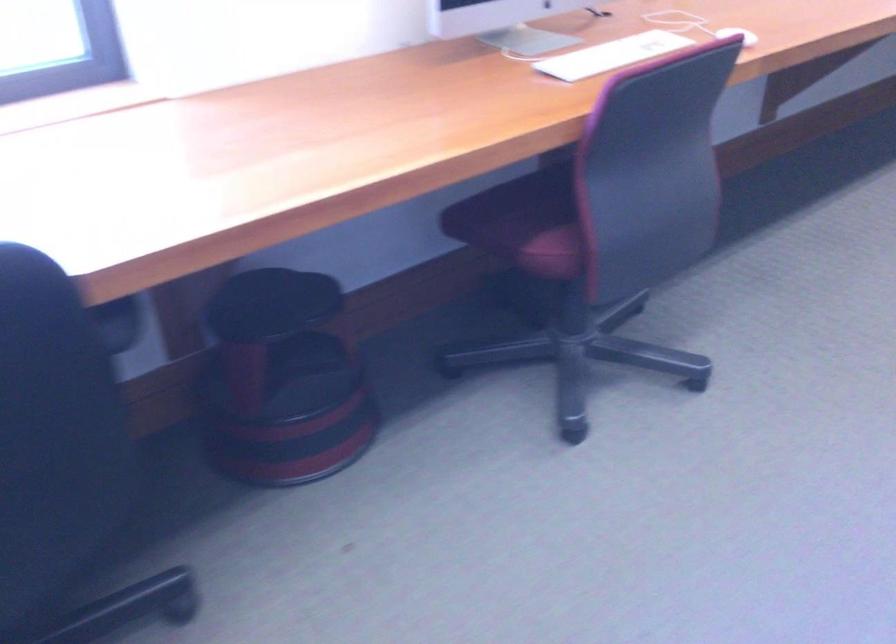
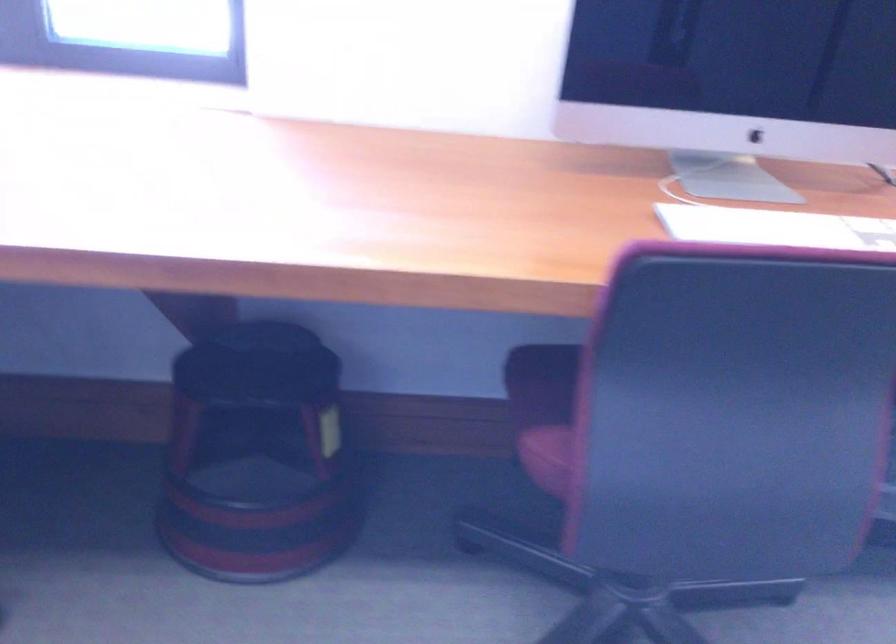
Question: The camera is either moving clockwise (left) or counter-clockwise (right) around the object. The first image is from the beginning of the video and the second image is from the end. Is the camera moving left or right when shooting the video?

Choices:
 (A) Left
 (B) Right

Answer: (B)